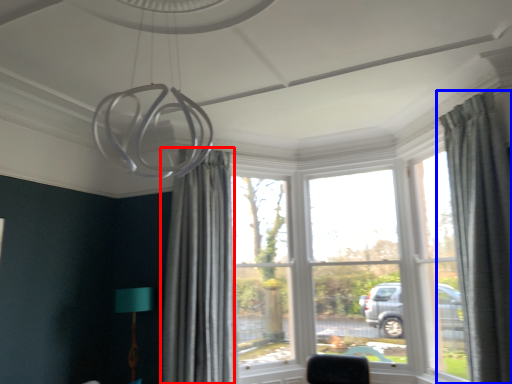
Question: Which point is closer to the camera, curtain (highlighted by a red box) or curtain (highlighted by a blue box)?

Choices:
 (A) curtain
 (B) curtain

Answer: (B)